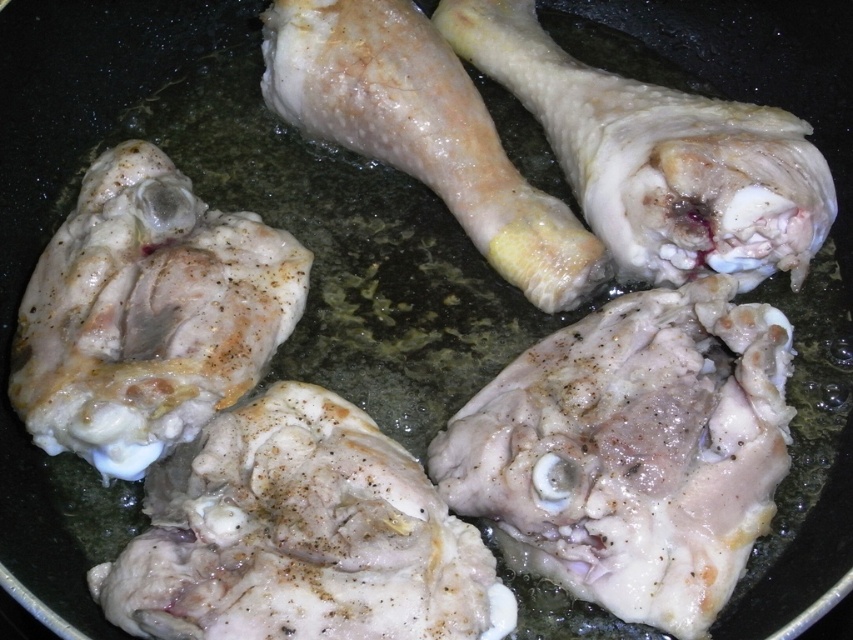
Question: Which object appears closest to the camera in this image?

Choices:
 (A) white matte chicken wing at center
 (B) white matte chicken thigh at center

Answer: (B)

Question: Where is white matte chicken thigh at center located in relation to white matte chicken wing at upper right in the image?

Choices:
 (A) right
 (B) left

Answer: (B)

Question: Which point is closer to the camera?

Choices:
 (A) (578, 65)
 (B) (119, 312)

Answer: (B)

Question: Can you confirm if white matte chicken wing at upper right is positioned below white matte chicken wing at center?

Choices:
 (A) yes
 (B) no

Answer: (B)

Question: Considering the real-world distances, which object is farthest from the white matte chicken wing at center?

Choices:
 (A) pale raw chicken thigh at center
 (B) white matte chicken wing at upper right

Answer: (A)

Question: Is white matte chicken thigh at center behind white matte chicken wing at center?

Choices:
 (A) no
 (B) yes

Answer: (A)